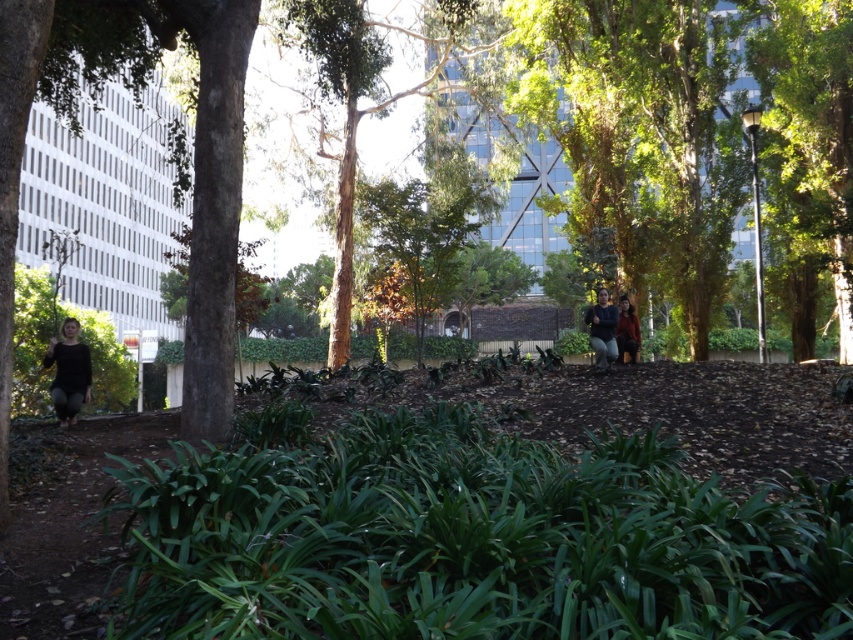
Does matte black pants at lower left have a lesser width compared to brown leather jacket at center?

Yes, matte black pants at lower left is thinner than brown leather jacket at center.

In the scene shown: Can you confirm if matte black pants at lower left is positioned to the left of brown leather jacket at center?

Yes, matte black pants at lower left is to the left of brown leather jacket at center.

Who is more forward, [79,380] or [618,344]?

Point [79,380]

I want to click on matte black pants at lower left, so click(x=68, y=372).

Is smooth bark tree at center to the left of brown leather jacket at center from the viewer's perspective?

Yes, smooth bark tree at center is to the left of brown leather jacket at center.

This screenshot has height=640, width=853. What do you see at coordinates (363, 99) in the screenshot?
I see `smooth bark tree at center` at bounding box center [363, 99].

Which is in front, point (296, 38) or point (622, 355)?

Point (622, 355)

Locate an element on the screen. smooth bark tree at center is located at coordinates (363, 99).

Is point (611, 324) closer to camera compared to point (624, 342)?

Yes, it is in front of point (624, 342).

Can you confirm if matte brown jacket at center is bigger than brown leather jacket at center?

Actually, matte brown jacket at center might be smaller than brown leather jacket at center.

Between point (625, 337) and point (614, 332), which one is positioned in front?

Point (614, 332)

Locate an element on the screen. Image resolution: width=853 pixels, height=640 pixels. matte brown jacket at center is located at coordinates (608, 330).